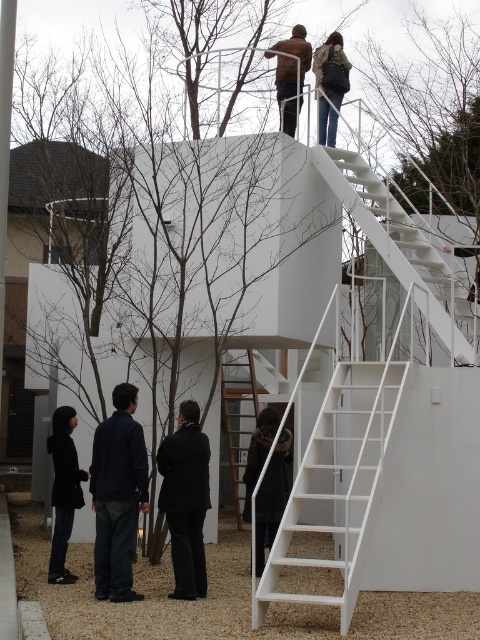
Is black matte coat at lower left smaller than white wooden ladder at center?

Yes, black matte coat at lower left is smaller than white wooden ladder at center.

Does black matte coat at lower left come behind white wooden ladder at center?

No, black matte coat at lower left is in front of white wooden ladder at center.

Is point (69, 488) positioned before point (241, 422)?

Yes.

You are a GUI agent. You are given a task and a screenshot of the screen. Output one action in this format:
    pyautogui.click(x=<x>, y=<y>)
    Task: Click on the black matte coat at lower left
    This screenshot has height=640, width=480.
    Given the screenshot: What is the action you would take?
    pyautogui.click(x=63, y=490)

Is white wooden ladder at center bigger than brown leather jacket at upper center?

Yes.

Who is more forward, (252, 371) or (268, 56)?

Point (268, 56) is in front.

Is point (240, 486) less distant than point (296, 61)?

That is False.

Find the location of a particular element. white wooden ladder at center is located at coordinates (238, 419).

Is dark blue jacket at lower left closer to camera compared to white wooden ladder at center?

Yes, dark blue jacket at lower left is closer to the viewer.

Can you confirm if dark blue jacket at lower left is positioned below white wooden ladder at center?

Actually, dark blue jacket at lower left is above white wooden ladder at center.

Is point (120, 596) in front of point (222, 388)?

Yes, it is.

You are a GUI agent. You are given a task and a screenshot of the screen. Output one action in this format:
    pyautogui.click(x=<x>, y=<y>)
    Task: Click on the dark blue jacket at lower left
    
    Given the screenshot: What is the action you would take?
    pyautogui.click(x=118, y=496)